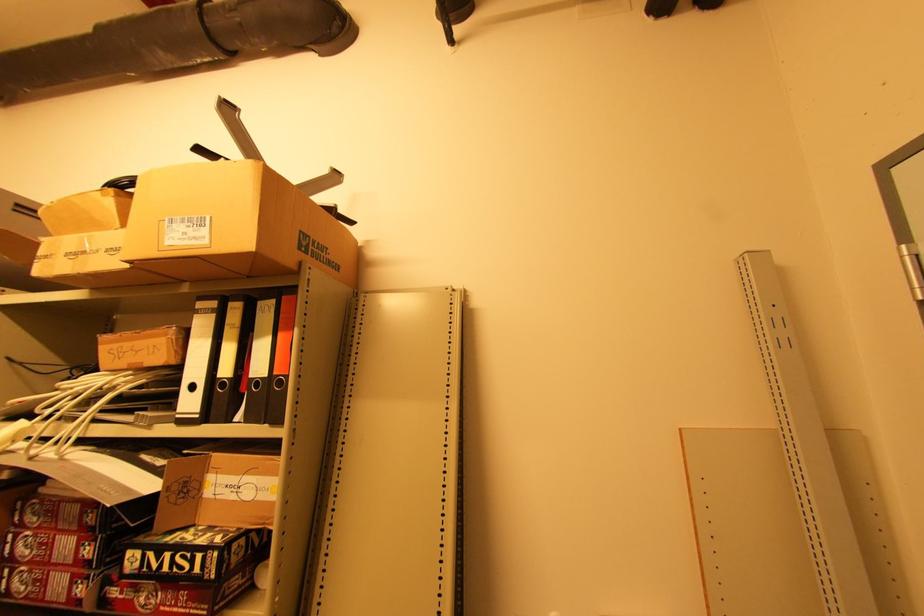
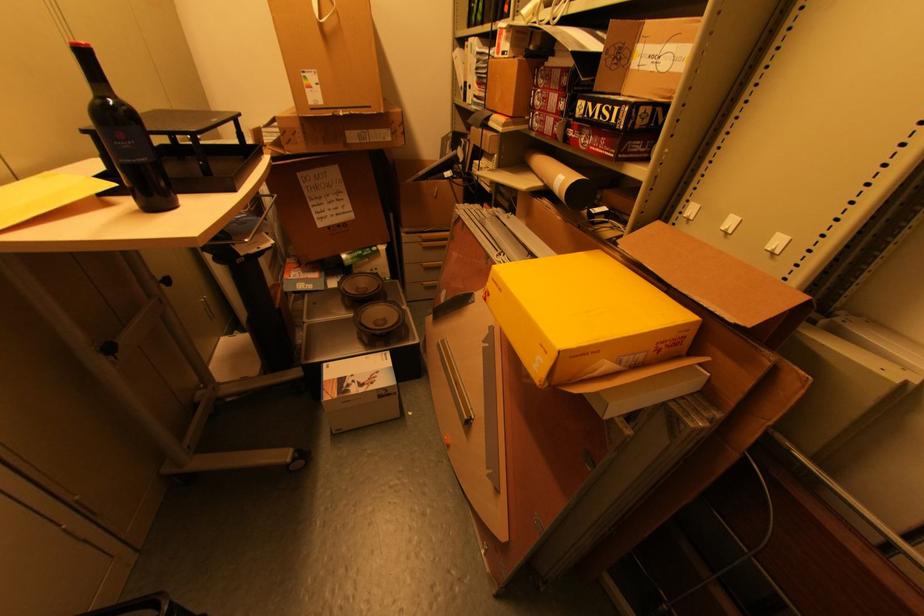
Locate, in the second image, the point that corresponds to (x=186, y=557) in the first image.

(610, 108)